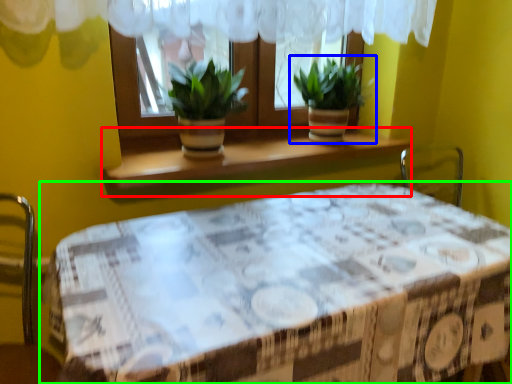
Question: Which is farther away from window sill (highlighted by a red box)? houseplant (highlighted by a blue box) or table (highlighted by a green box)?

Choices:
 (A) houseplant
 (B) table

Answer: (B)